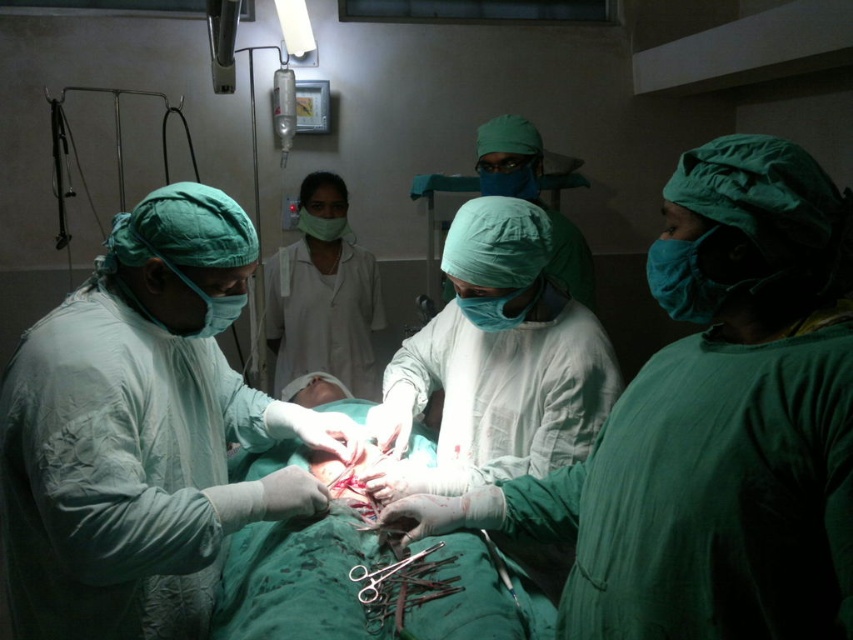
You are a medical student observing a surgery. You notice two objects at the center of the operating table. One is the surgical scissors at center and the other is the matte green surgical cap at center. Which object has a smaller width?

The surgical scissors at center is thinner than the matte green surgical cap at center, so the surgical scissors at center has a smaller width.

You are a medical student observing the surgery. You notice two objects at the center of the operating table area. One is the surgical scissors at center and the other is the matte green surgical cap at center. Which object takes up more space in the image?

The matte green surgical cap at center occupies more space than the surgical scissors at center.

You are a medical student observing a surgery from a distance. You need to reach a specific point in the operating room to retrieve a tool. The point is located at coordinates point (108, 444). If your current position is 1.5 meters away from the camera, can you safely reach that point without moving too far?

The distance of point (108, 444) from camera is 1.30 meters. Since your current position is 1.5 meters away from the camera, you are 0.2 meters behind the point. You can safely reach it by moving forward slightly.